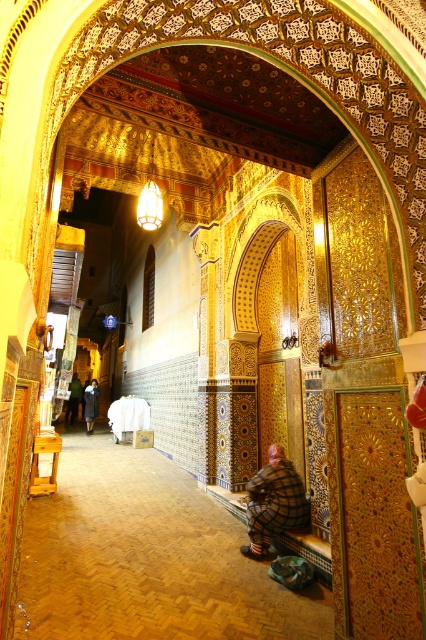
You are standing in this ornate room and need to pass through a narrow doorway that requires you to crouch. The plaid fabric person at lower center and the dark gray wool coat at left are in your path. Which object should you move first to ensure you can pass through the doorway?

The plaid fabric person at lower center is shorter than the dark gray wool coat at left, so you should move the plaid fabric person at lower center first since it is shorter and easier to maneuver under the doorway.

You are an interior designer planning to place a new sofa in this space. You have two options based on the existing items in the scene. The plaid fabric person at lower center and the dark gray wool coat at left. Which of these two items is smaller in size?

The plaid fabric person at lower center is smaller in size compared to the dark gray wool coat at left according to the description.

You are standing in this ornate room and notice two points marked on the wall. The first point is located at coordinates point (92, 385) and the second at point (74, 412). Which of these points is closer to you?

Point (92, 385) is closer to the viewer than point (74, 412).